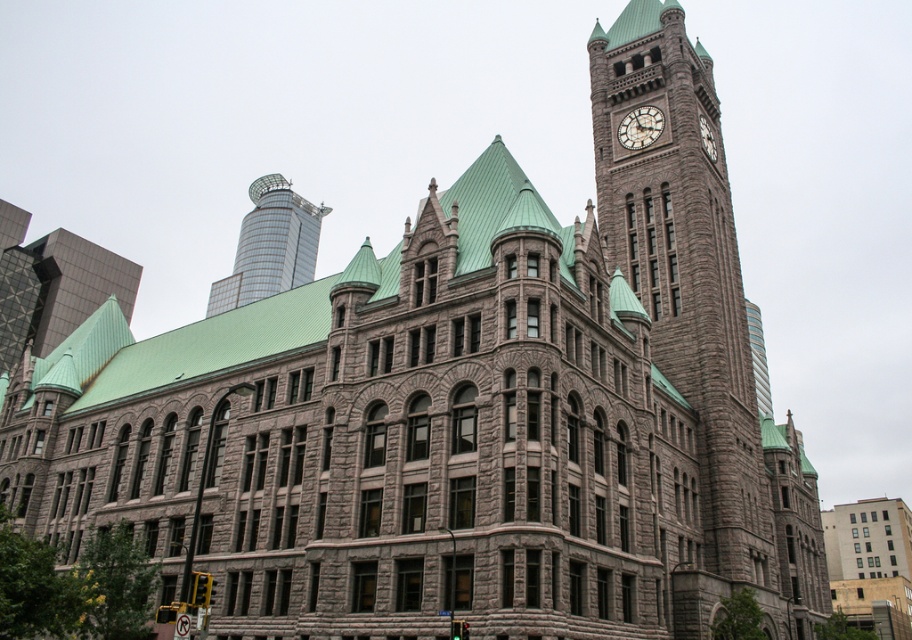
Is matte gray clock at upper right closer to camera compared to white stone clock at upper right?

No, matte gray clock at upper right is further to the viewer.

Does point (646, 116) lie in front of point (710, 140)?

Yes, it is in front of point (710, 140).

What do you see at coordinates (640, 128) in the screenshot? I see `matte gray clock at upper right` at bounding box center [640, 128].

I want to click on matte gray clock at upper right, so click(640, 128).

Who is positioned more to the right, green glass skyscraper at left or shiny glass skyscraper at upper left?

From the viewer's perspective, green glass skyscraper at left appears more on the right side.

Between green glass skyscraper at left and shiny glass skyscraper at upper left, which one has less height?

green glass skyscraper at left is shorter.

The width and height of the screenshot is (912, 640). I want to click on green glass skyscraper at left, so click(x=56, y=291).

Can you confirm if gray stone clock tower at upper center is smaller than green glass skyscraper at left?

No, gray stone clock tower at upper center is not smaller than green glass skyscraper at left.

Who is shorter, gray stone clock tower at upper center or green glass skyscraper at left?

With less height is green glass skyscraper at left.

Between point (693, 328) and point (83, 296), which one is positioned in front?

Point (693, 328)

Find the location of a particular element. The image size is (912, 640). gray stone clock tower at upper center is located at coordinates (687, 310).